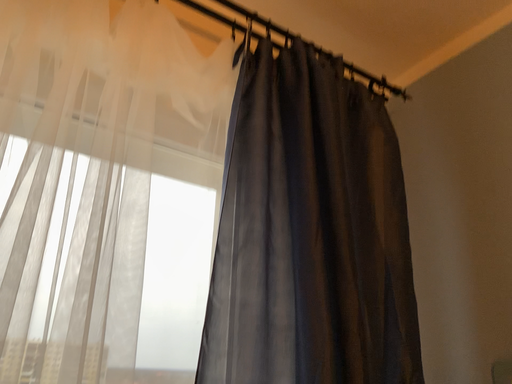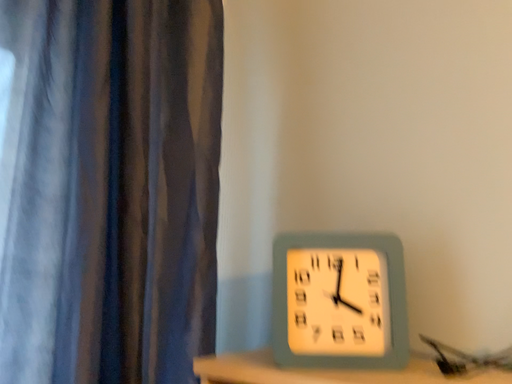
Question: Which way did the camera rotate in the video?

Choices:
 (A) rotated downward
 (B) rotated upward

Answer: (A)